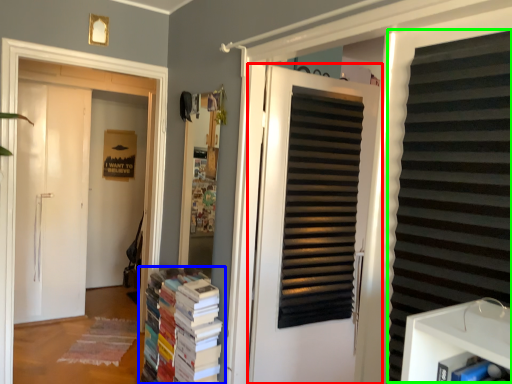
Question: Which is farther away from door (highlighted by a red box)? book (highlighted by a blue box) or shutter (highlighted by a green box)?

Choices:
 (A) book
 (B) shutter

Answer: (B)